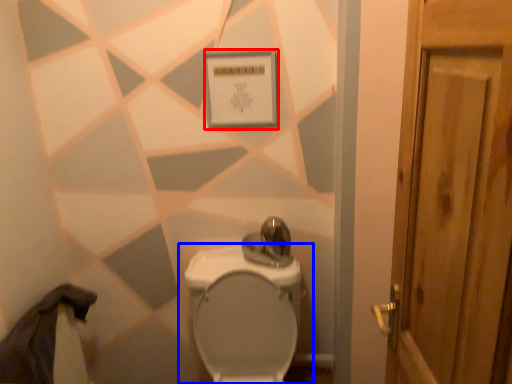
Question: Which of the following is the closest to the observer, square (highlighted by a red box) or toilet (highlighted by a blue box)?

Choices:
 (A) square
 (B) toilet

Answer: (B)